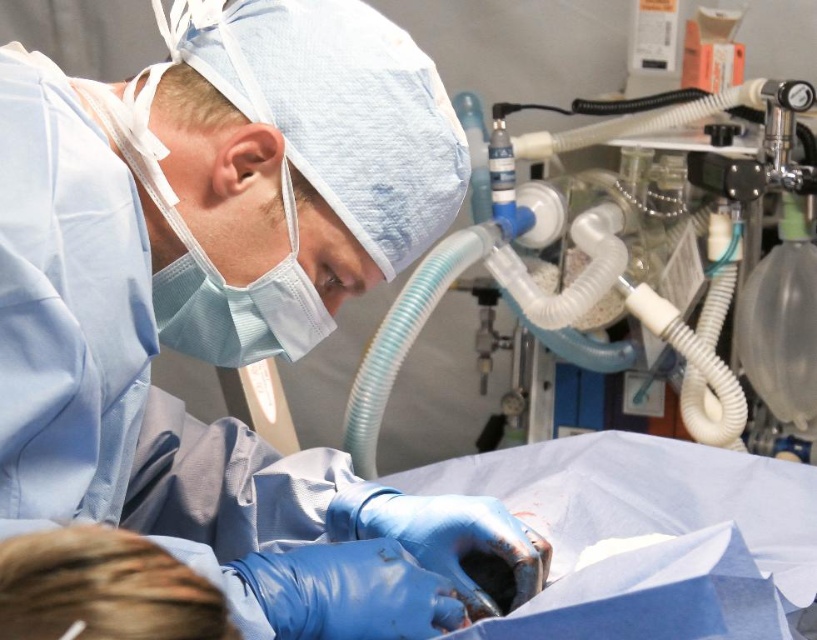
You are a medical student observing a surgical procedure. You notice the blue latex gloves at lower center and the white rubber tubing at upper right. Which object is located lower in the image?

The blue latex gloves at lower center are positioned under the white rubber tubing at upper right, meaning the blue latex gloves at lower center are located lower in the image.

You are a medical student observing a surgery and need to identify the positions of the blue latex gloves at lower center and the white rubber tubing at upper right. Which object is shorter in height?

The blue latex gloves at lower center is shorter in height than the white rubber tubing at upper right.

You are a surgical nurse preparing to sterilize equipment. You have a 30 inch long sterilization tray. Can you place both the blue latex gloves at lower center and the white rubber tubing at upper right on the tray without overlapping?

The distance between the blue latex gloves at lower center and the white rubber tubing at upper right is 32.15 inches. Since the tray is only 30 inches long, the items cannot be placed on the tray without overlapping.